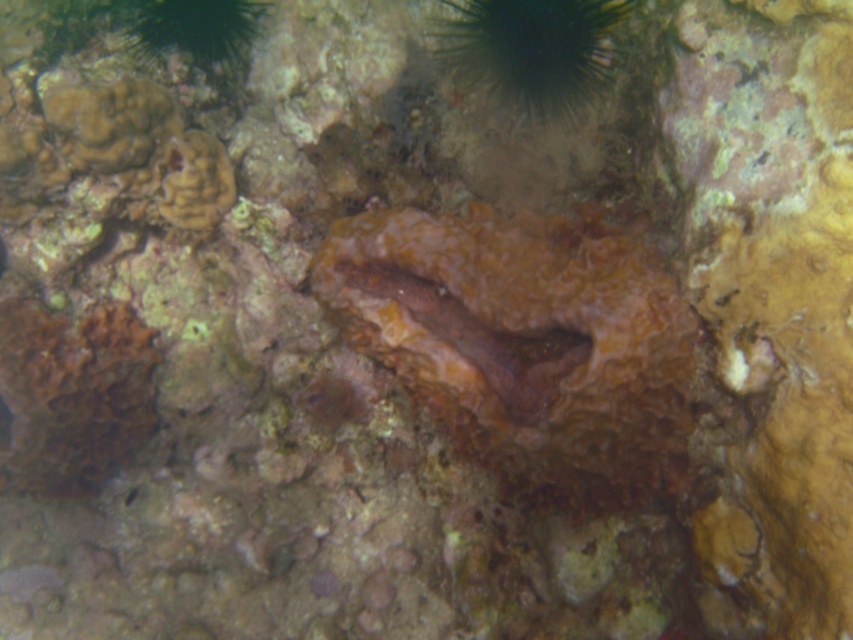
Between point (44, 323) and point (570, 58), which one is positioned in front?

Point (570, 58)

Who is more distant from viewer, (106,314) or (500,10)?

The point (106,314) is behind.

You are a GUI agent. You are given a task and a screenshot of the screen. Output one action in this format:
    pyautogui.click(x=<x>, y=<y>)
    Task: Click on the brown rough coral at lower left
    This screenshot has height=640, width=853.
    Given the screenshot: What is the action you would take?
    pyautogui.click(x=73, y=394)

Is orange sponge at center positioned behind green spiky sea urchin at upper center?

That is False.

Who is positioned more to the left, orange sponge at center or green spiky sea urchin at upper center?

orange sponge at center

Which is in front, point (595, 248) or point (502, 93)?

Point (595, 248) is in front.

Where is `orange sponge at center`? The height and width of the screenshot is (640, 853). orange sponge at center is located at coordinates (525, 342).

This screenshot has height=640, width=853. What do you see at coordinates (525, 342) in the screenshot?
I see `orange sponge at center` at bounding box center [525, 342].

Does orange sponge at center appear under brown rough coral at lower left?

Actually, orange sponge at center is above brown rough coral at lower left.

Who is more distant from viewer, (630, 308) or (119, 417)?

Positioned behind is point (119, 417).

This screenshot has width=853, height=640. Identify the location of orange sponge at center. (525, 342).